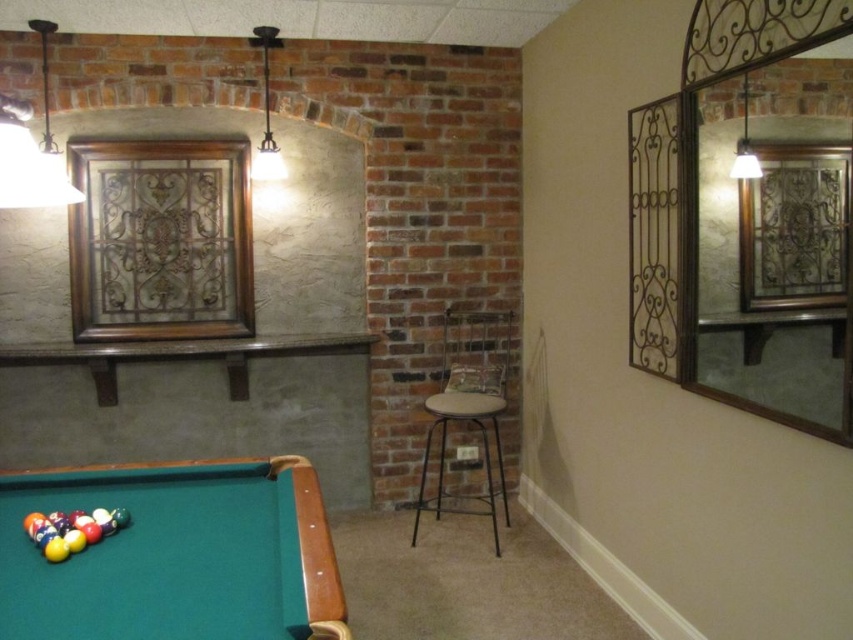
Question: Which point is closer to the camera?

Choices:
 (A) (212, 621)
 (B) (428, 500)

Answer: (A)

Question: Does green felt pool table at lower left have a lesser width compared to metallic black bar stool at center?

Choices:
 (A) yes
 (B) no

Answer: (B)

Question: Does green felt pool table at lower left have a greater width compared to metallic black bar stool at center?

Choices:
 (A) yes
 (B) no

Answer: (A)

Question: Is green felt pool table at lower left to the left of metallic black bar stool at center from the viewer's perspective?

Choices:
 (A) yes
 (B) no

Answer: (A)